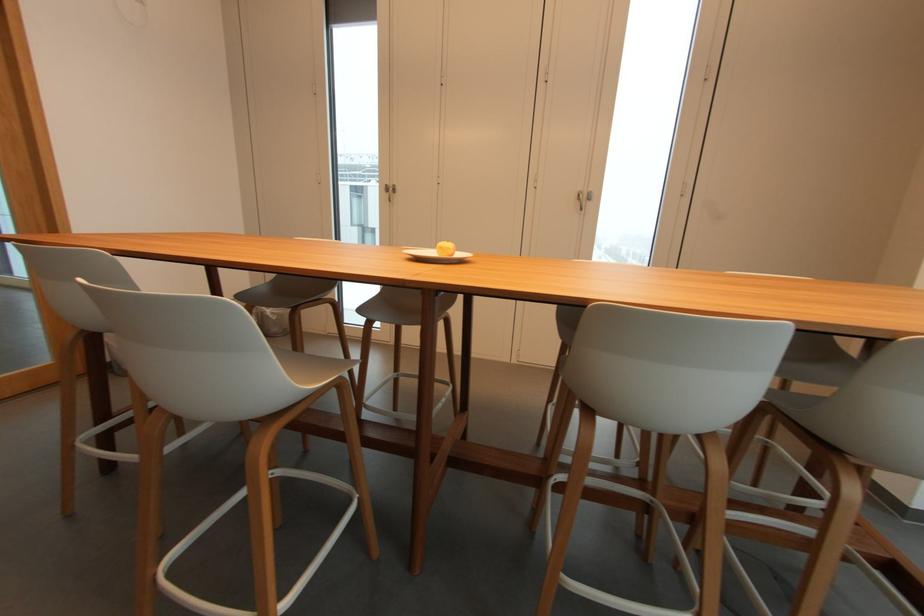
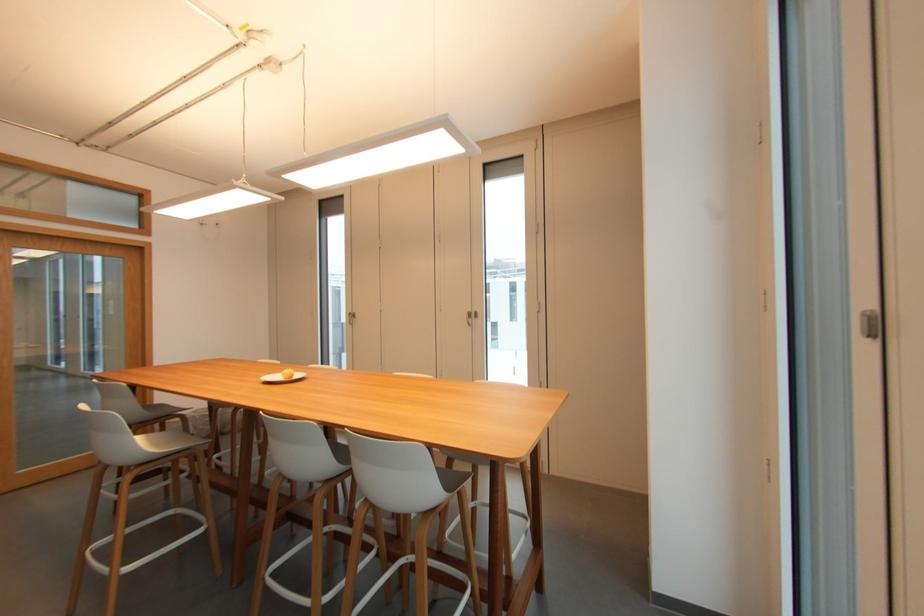
Locate, in the second image, the point that corresponds to (392,184) in the first image.

(354, 312)